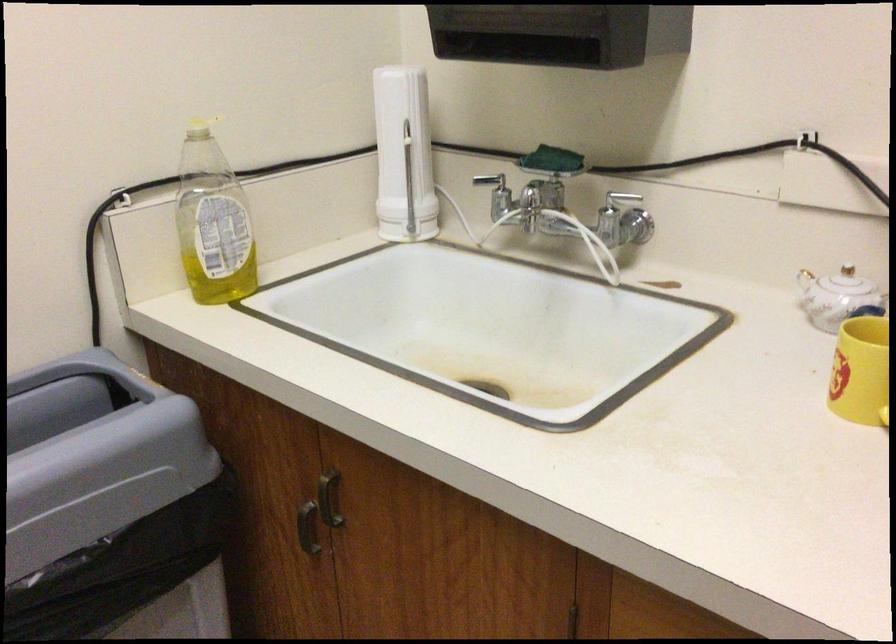
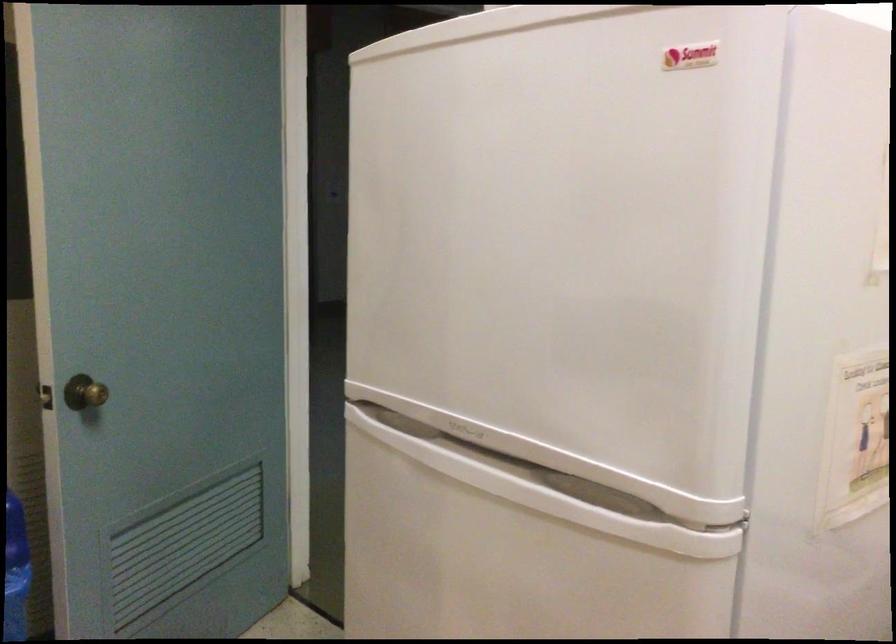
Question: The camera is either moving clockwise (left) or counter-clockwise (right) around the object. The first image is from the beginning of the video and the second image is from the end. Is the camera moving left or right when shooting the video?

Choices:
 (A) Left
 (B) Right

Answer: (B)